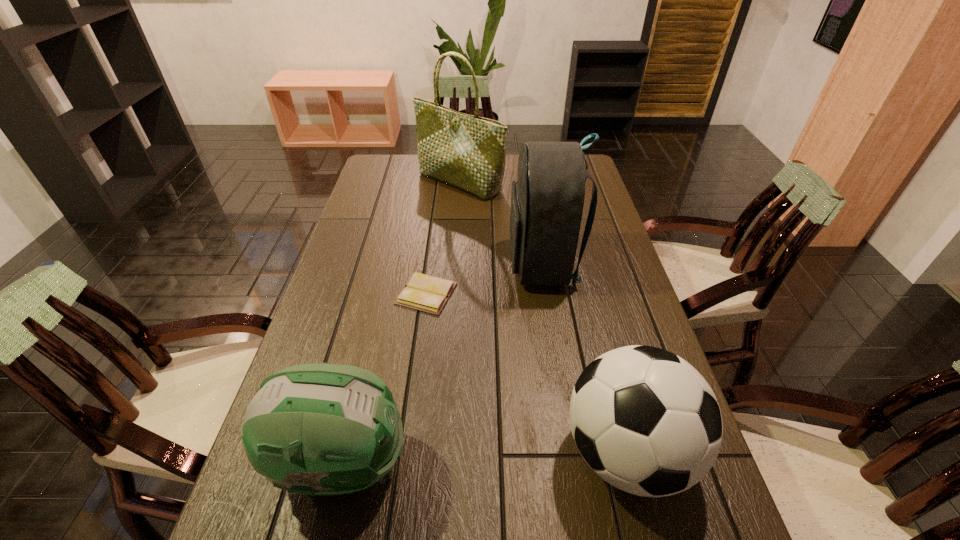
At what (x,y) coordinates should I click in order to perform the action: click on free point between the football helmet and the soccer ball. Please return your answer as a coordinate pair (x, y). The width and height of the screenshot is (960, 540). Looking at the image, I should click on (485, 458).

Locate an element on the screen. This screenshot has height=540, width=960. free spot between the soccer ball and the backpack is located at coordinates (585, 358).

At what (x,y) coordinates should I click in order to perform the action: click on free space between the football helmet and the soccer ball. Please return your answer as a coordinate pair (x, y). The height and width of the screenshot is (540, 960). Looking at the image, I should click on (485, 458).

Where is `vacant area that lies between the soccer ball and the football helmet`? The height and width of the screenshot is (540, 960). vacant area that lies between the soccer ball and the football helmet is located at coordinates (485, 458).

In order to click on unoccupied position between the soccer ball and the shortest object in this screenshot , I will do `click(526, 373)`.

Image resolution: width=960 pixels, height=540 pixels. I want to click on free space between the football helmet and the backpack, so click(443, 364).

Identify the location of free space between the football helmet and the backpack. This screenshot has height=540, width=960. (443, 364).

Find the location of a particular element. Image resolution: width=960 pixels, height=540 pixels. unoccupied position between the football helmet and the shortest object is located at coordinates (384, 379).

Locate an element on the screen. free space between the farthest object and the football helmet is located at coordinates (401, 323).

Find the location of `vacant space that's between the football helmet and the soccer ball`. vacant space that's between the football helmet and the soccer ball is located at coordinates (485, 458).